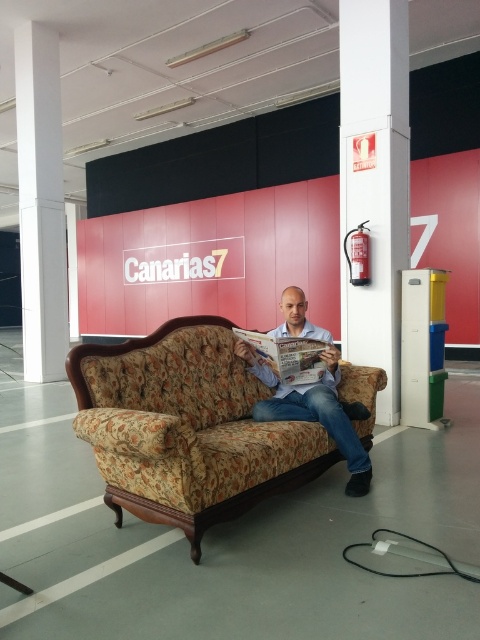
Question: Is floral fabric couch at center above white glossy fire extinguisher at right?

Choices:
 (A) yes
 (B) no

Answer: (B)

Question: Which point appears farthest from the camera in this image?

Choices:
 (A) (324, 426)
 (B) (55, 72)
 (C) (372, 228)

Answer: (B)

Question: Among these points, which one is farthest from the camera?

Choices:
 (A) (26, 310)
 (B) (205, 339)
 (C) (336, 349)
 (D) (360, 20)

Answer: (A)

Question: Which object is the farthest from the white smooth pillar at left?

Choices:
 (A) white glossy fire extinguisher at right
 (B) matte blue shirt at center
 (C) floral fabric couch at center

Answer: (B)

Question: Is floral fabric couch at center in front of matte blue shirt at center?

Choices:
 (A) yes
 (B) no

Answer: (A)

Question: Is floral fabric couch at center wider than white glossy fire extinguisher at right?

Choices:
 (A) no
 (B) yes

Answer: (B)